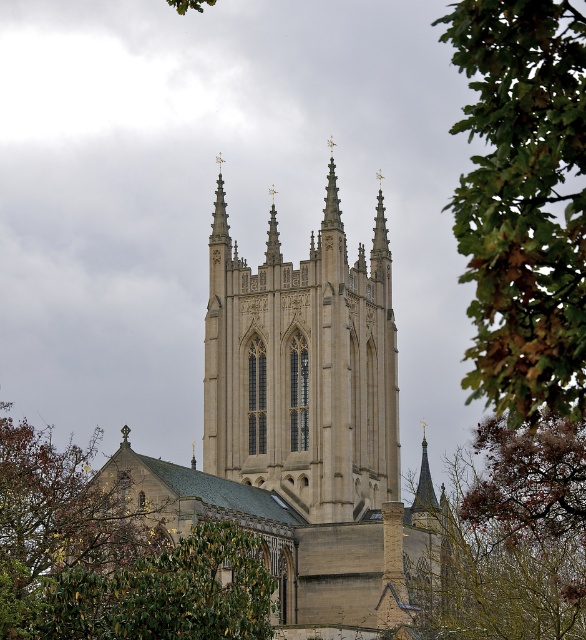
Can you confirm if green leafy tree at lower left is thinner than brown textured leaves at lower right?

Incorrect, green leafy tree at lower left's width is not less than brown textured leaves at lower right's.

Can you confirm if green leafy tree at lower left is shorter than brown textured leaves at lower right?

Yes.

Between point (32, 545) and point (505, 524), which one is positioned behind?

The point (505, 524) is behind.

You are a GUI agent. You are given a task and a screenshot of the screen. Output one action in this format:
    pyautogui.click(x=<x>, y=<y>)
    Task: Click on the green leafy tree at lower left
    Image resolution: width=586 pixels, height=640 pixels.
    Given the screenshot: What is the action you would take?
    pyautogui.click(x=111, y=557)

Can you confirm if green leafy tree at upper right is smaller than brown textured leaves at lower right?

Incorrect, green leafy tree at upper right is not smaller in size than brown textured leaves at lower right.

From the picture: Does green leafy tree at upper right have a lesser height compared to brown textured leaves at lower right?

In fact, green leafy tree at upper right may be taller than brown textured leaves at lower right.

Between point (527, 248) and point (492, 516), which one is positioned behind?

The point (492, 516) is more distant.

Find the location of a particular element. green leafy tree at upper right is located at coordinates (523, 202).

The image size is (586, 640). Describe the element at coordinates (301, 428) in the screenshot. I see `beige stone church at center` at that location.

At what (x,y) coordinates should I click in order to perform the action: click on beige stone church at center. Please return your answer as a coordinate pair (x, y). Looking at the image, I should click on (301, 428).

Locate an element on the screen. This screenshot has width=586, height=640. beige stone church at center is located at coordinates (301, 428).